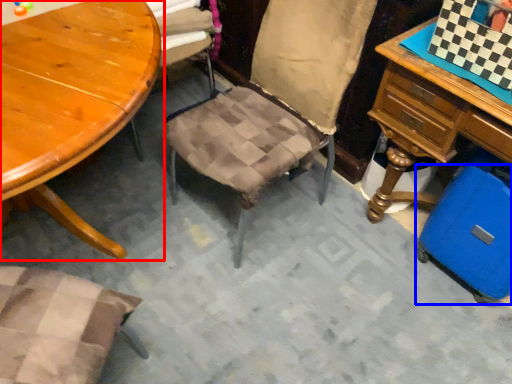
Question: Which object appears farthest to the camera in this image, table (highlighted by a red box) or luggage (highlighted by a blue box)?

Choices:
 (A) table
 (B) luggage

Answer: (B)